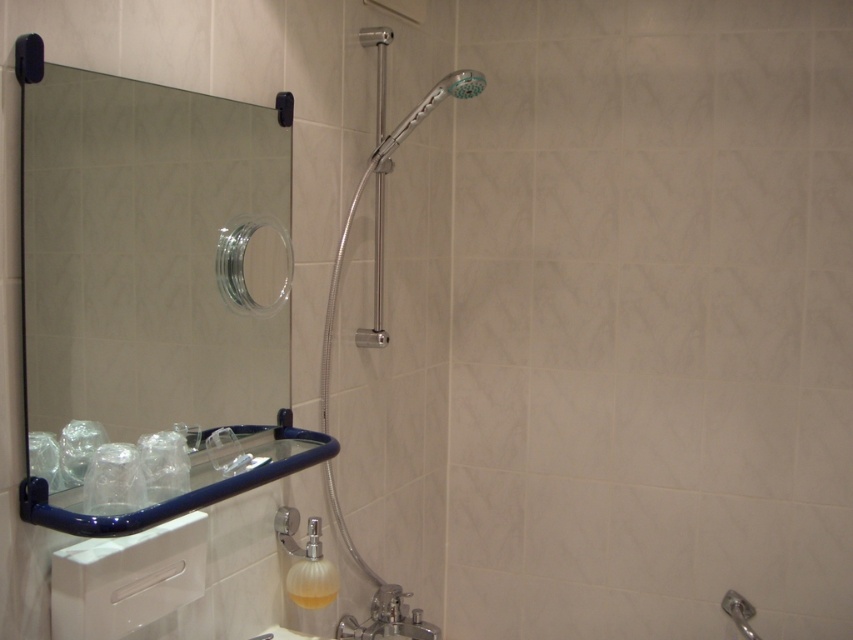
Question: Which point is farther to the camera?

Choices:
 (A) (317, 518)
 (B) (125, 195)

Answer: (A)

Question: Which point appears farthest from the camera in this image?

Choices:
 (A) (474, 83)
 (B) (54, 259)

Answer: (A)

Question: Is translucent plastic soap dispenser at lower center to the right of silver metallic shower head at upper center from the viewer's perspective?

Choices:
 (A) no
 (B) yes

Answer: (A)

Question: Does translucent plastic soap dispenser at lower center have a lesser width compared to silver metallic shower head at upper center?

Choices:
 (A) no
 (B) yes

Answer: (B)

Question: Which point is farther to the camera?

Choices:
 (A) silver metallic shower head at upper center
 (B) polished chrome shower head at upper center
 (C) translucent plastic soap dispenser at lower center

Answer: (B)

Question: Is polished chrome shower head at upper center closer to camera compared to silver metallic shower head at upper center?

Choices:
 (A) yes
 (B) no

Answer: (B)